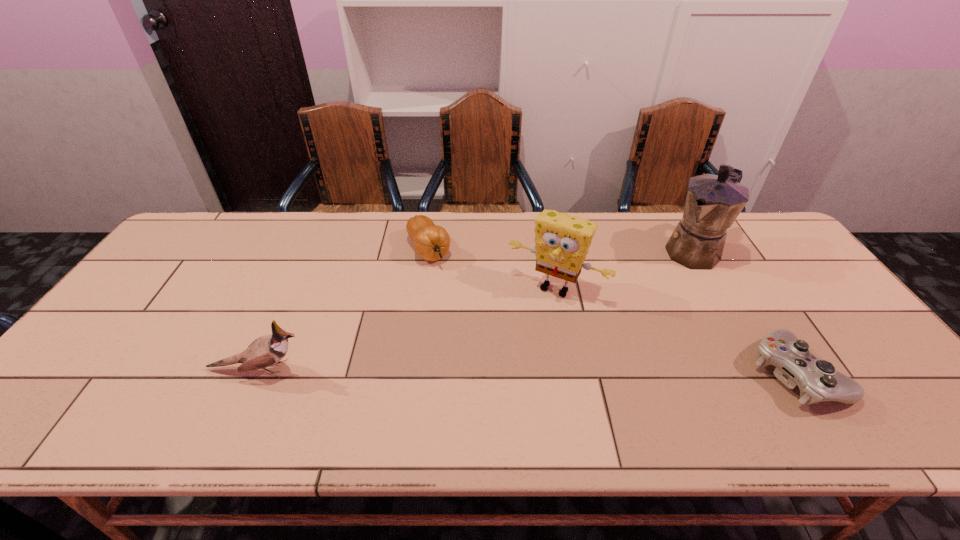
Where is `bird`? The image size is (960, 540). bird is located at coordinates (265, 351).

Where is `the leftmost object`? Image resolution: width=960 pixels, height=540 pixels. the leftmost object is located at coordinates (265, 351).

Find the location of `the shortest object`. the shortest object is located at coordinates (818, 381).

The width and height of the screenshot is (960, 540). What are the coordinates of `the fourth shortest object` in the screenshot? It's located at (562, 241).

Locate an element on the screen. This screenshot has height=540, width=960. the third object from right to left is located at coordinates (562, 241).

The image size is (960, 540). I want to click on the fourth tallest object, so click(x=431, y=242).

Identify the location of gourd. Image resolution: width=960 pixels, height=540 pixels. (431, 242).

Where is `the tallest object`? the tallest object is located at coordinates (713, 202).

The width and height of the screenshot is (960, 540). Identify the location of free spot located at the face of the bird. (339, 369).

The width and height of the screenshot is (960, 540). What are the coordinates of `free space located 0.080m on the back of the control` in the screenshot? It's located at (758, 314).